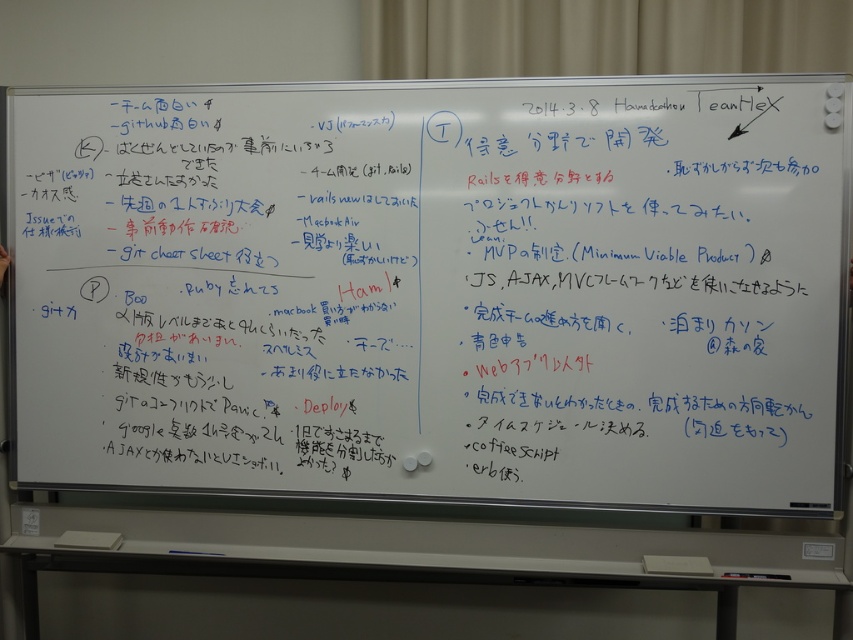
Question: Which of the following is the farthest from the observer?

Choices:
 (A) (311, 492)
 (B) (88, 545)
 (C) (672, 563)

Answer: (B)

Question: Which object is farther from the camera taking this photo?

Choices:
 (A) whiteboard at center
 (B) white paper at bottom
 (C) white paper at lower center

Answer: (C)

Question: Which point is closer to the camera?

Choices:
 (A) white paper at lower center
 (B) whiteboard at center

Answer: (B)

Question: Does whiteboard at center lie in front of white paper at bottom?

Choices:
 (A) no
 (B) yes

Answer: (B)

Question: Can you confirm if white paper at bottom is thinner than white paper at lower center?

Choices:
 (A) yes
 (B) no

Answer: (A)

Question: Can you confirm if white paper at bottom is positioned to the right of white paper at lower center?

Choices:
 (A) yes
 (B) no

Answer: (A)